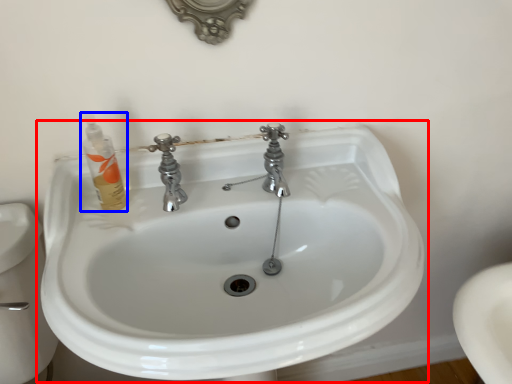
Question: Which of the following is the closest to the observer, sink (highlighted by a red box) or toiletry (highlighted by a blue box)?

Choices:
 (A) sink
 (B) toiletry

Answer: (A)